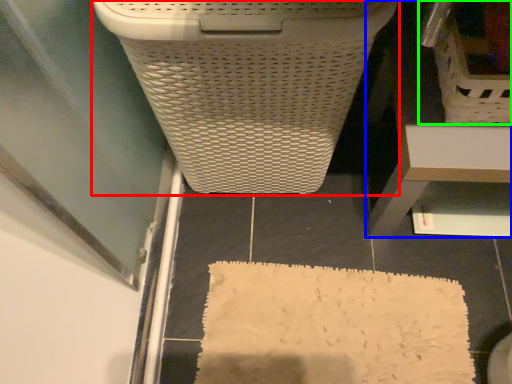
Question: Which object is the farthest from waste container (highlighted by a red box)? Choose among these: furniture (highlighted by a blue box) or laundry basket (highlighted by a green box).

Choices:
 (A) furniture
 (B) laundry basket

Answer: (B)